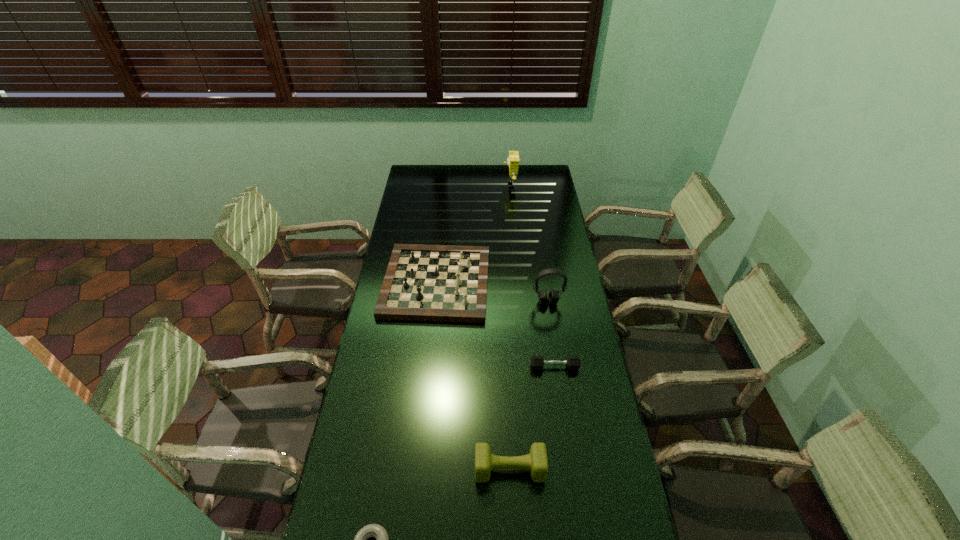
Image resolution: width=960 pixels, height=540 pixels. I want to click on vacant space that satisfies the following two spatial constraints: 1. on the front side of the nearer dumbbell; 2. on the left side of the chessboard, so click(x=417, y=469).